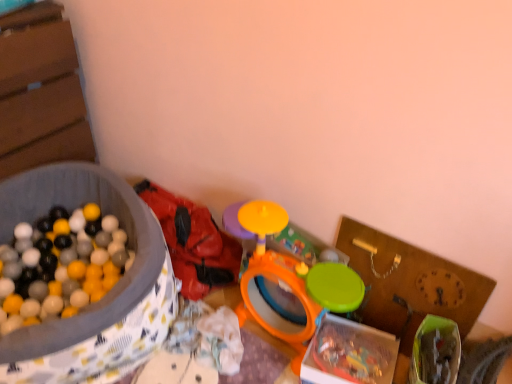
Question: From a real-world perspective, is translucent plastic box at center, positioned as the 2th box in left-to-right order, located higher than rubberized red backpack at center, which is counted as the 1th toy, starting from the left?

Choices:
 (A) no
 (B) yes

Answer: (A)

Question: Does translucent plastic box at center, positioned as the 2th box in left-to-right order, have a smaller size compared to rubberized red backpack at center, which is counted as the 1th toy, starting from the left?

Choices:
 (A) no
 (B) yes

Answer: (B)

Question: Can you confirm if translucent plastic box at center, positioned as the 1th box in right-to-left order, is wider than rubberized red backpack at center, which is counted as the 1th toy, starting from the left?

Choices:
 (A) no
 (B) yes

Answer: (A)

Question: Is the position of translucent plastic box at center, positioned as the 2th box in left-to-right order, more distant than that of rubberized red backpack at center, which is counted as the 1th toy, starting from the left?

Choices:
 (A) no
 (B) yes

Answer: (A)

Question: Is translucent plastic box at center, positioned as the 2th box in left-to-right order, bigger than rubberized red backpack at center, arranged as the 2th toy when viewed from the right?

Choices:
 (A) yes
 (B) no

Answer: (B)

Question: Is translucent plastic box at center, positioned as the 1th box in right-to-left order, oriented towards rubberized red backpack at center, which is counted as the 1th toy, starting from the left?

Choices:
 (A) no
 (B) yes

Answer: (A)

Question: Is the depth of rubberized red backpack at center, which is counted as the 1th toy, starting from the left, less than that of translucent plastic box at center, positioned as the 1th box in right-to-left order?

Choices:
 (A) no
 (B) yes

Answer: (A)

Question: Is translucent plastic box at center, positioned as the 2th box in left-to-right order, located within rubberized red backpack at center, which is counted as the 1th toy, starting from the left?

Choices:
 (A) no
 (B) yes

Answer: (A)

Question: Is rubberized red backpack at center, arranged as the 2th toy when viewed from the right, further to the viewer compared to translucent plastic box at center, positioned as the 2th box in left-to-right order?

Choices:
 (A) yes
 (B) no

Answer: (A)

Question: Can you confirm if rubberized red backpack at center, arranged as the 2th toy when viewed from the right, is bigger than translucent plastic box at center, positioned as the 1th box in right-to-left order?

Choices:
 (A) no
 (B) yes

Answer: (B)

Question: Considering the relative sizes of rubberized red backpack at center, arranged as the 2th toy when viewed from the right, and translucent plastic box at center, positioned as the 2th box in left-to-right order, in the image provided, is rubberized red backpack at center, arranged as the 2th toy when viewed from the right, shorter than translucent plastic box at center, positioned as the 2th box in left-to-right order,?

Choices:
 (A) yes
 (B) no

Answer: (B)

Question: From the image's perspective, is rubberized red backpack at center, arranged as the 2th toy when viewed from the right, on translucent plastic box at center, positioned as the 2th box in left-to-right order?

Choices:
 (A) no
 (B) yes

Answer: (B)

Question: Can you confirm if translucent plastic box at center, positioned as the 2th box in left-to-right order, is taller than matte plastic ball pit at left, arranged as the first box when viewed from the left?

Choices:
 (A) yes
 (B) no

Answer: (B)